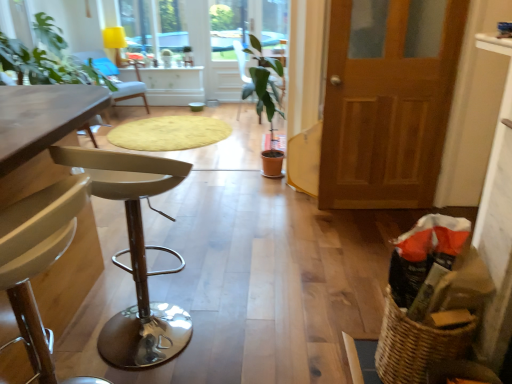
What are the coordinates of `beige textured rug at center` in the screenshot? It's located at (169, 133).

Where is `wooden table at left, which ranks as the 1th table in back-to-front order`? wooden table at left, which ranks as the 1th table in back-to-front order is located at coordinates (40, 132).

What do you see at coordinates (115, 41) in the screenshot?
I see `yellow fabric lampshade at upper center` at bounding box center [115, 41].

What do you see at coordinates (261, 79) in the screenshot? I see `green matte plant at center, positioned as the third chair in left-to-right order` at bounding box center [261, 79].

What do you see at coordinates (135, 258) in the screenshot? The image size is (512, 384). I see `metallic silver stool at left, the second chair when ordered from left to right` at bounding box center [135, 258].

This screenshot has width=512, height=384. Find the location of `beige textured rug at center`. beige textured rug at center is located at coordinates (169, 133).

Which is more distant, (x=190, y=141) or (x=353, y=181)?

The point (x=190, y=141) is farther from the camera.

From a real-world perspective, is beige textured rug at center physically located above or below wooden door at right?

beige textured rug at center is below wooden door at right.

Is beige textured rug at center thinner than wooden door at right?

Incorrect, the width of beige textured rug at center is not less than that of wooden door at right.

In the image, is yellow fabric lampshade at upper center positioned in front of or behind woven brown basket at lower right?

yellow fabric lampshade at upper center is positioned farther from the viewer than woven brown basket at lower right.

Considering the relative sizes of yellow fabric lampshade at upper center and woven brown basket at lower right in the image provided, is yellow fabric lampshade at upper center bigger than woven brown basket at lower right?

Incorrect, yellow fabric lampshade at upper center is not larger than woven brown basket at lower right.

From the image's perspective, is yellow fabric lampshade at upper center under woven brown basket at lower right?

Incorrect, from the image's perspective, yellow fabric lampshade at upper center is higher than woven brown basket at lower right.

Considering their positions, is wooden table at left, which appears as the second table when viewed from the left, located in front of or behind wooden door at right?

Clearly, wooden table at left, which appears as the second table when viewed from the left, is in front of wooden door at right.

Is wooden table at left, marked as the first table in a right-to-left arrangement, shorter than wooden door at right?

Yes, wooden table at left, marked as the first table in a right-to-left arrangement, is shorter than wooden door at right.

In the image, there is a wooden door at right. Find the location of `table below it (from the image's perspective)`. table below it (from the image's perspective) is located at coordinates (40, 133).

Looking at this image, which object is positioned more to the left, wooden table at left, which is the 2th table from back to front, or wooden door at right?

wooden table at left, which is the 2th table from back to front.

Which chair is the 1st one when counting from the front of the light gray fabric chair at upper left, the first chair when ordered from back to front? Please provide its 2D coordinates.

[(261, 79)]

Is light gray fabric chair at upper left, the third chair from the front, further to camera compared to green matte plant at center, placed as the 1th chair when sorted from right to left?

Yes.

From the picture: Is light gray fabric chair at upper left, which is the 1th chair in left-to-right order, wider or thinner than green matte plant at center, which is counted as the 2th chair, starting from the back?

In the image, light gray fabric chair at upper left, which is the 1th chair in left-to-right order, appears to be wider than green matte plant at center, which is counted as the 2th chair, starting from the back.

Is light gray fabric chair at upper left, the third chair from the front, oriented away from green matte plant at center, positioned as the third chair in left-to-right order?

No, light gray fabric chair at upper left, the third chair from the front,'s orientation is not away from green matte plant at center, positioned as the third chair in left-to-right order.

Are wooden door at right and transparent glass window at upper center beside each other?

wooden door at right and transparent glass window at upper center are not in contact.

Would you say wooden door at right is outside transparent glass window at upper center?

Yes, wooden door at right is outside of transparent glass window at upper center.

Is point (395, 77) positioned in front of point (162, 32)?

Yes, point (395, 77) is in front of point (162, 32).

In the scene shown: From the image's perspective, is wooden door at right over transparent glass window at upper center?

No.

Which object is further away from the camera, woven brown basket at lower right or metallic silver stool at left, which appears as the first chair when viewed from the front?

woven brown basket at lower right is behind.

In the scene shown: From a real-world perspective, is woven brown basket at lower right located higher than metallic silver stool at left, the second chair when ordered from left to right?

Actually, woven brown basket at lower right is physically below metallic silver stool at left, the second chair when ordered from left to right, in the real world.

Considering the sizes of woven brown basket at lower right and metallic silver stool at left, the second chair in the right-to-left sequence, in the image, is woven brown basket at lower right bigger or smaller than metallic silver stool at left, the second chair in the right-to-left sequence,?

Considering their sizes, woven brown basket at lower right takes up less space than metallic silver stool at left, the second chair in the right-to-left sequence.

From a real-world perspective, is transparent glass window at upper center on woven brown basket at lower right?

Yes, from a real-world perspective, transparent glass window at upper center is on top of woven brown basket at lower right.

Who is shorter, transparent glass window at upper center or woven brown basket at lower right?

With less height is woven brown basket at lower right.

Is point (125, 17) closer or farther from the camera than point (389, 326)?

Clearly, point (125, 17) is more distant from the camera than point (389, 326).

At what (x,y) coordinates should I click in order to perform the action: click on door above the beige textured rug at center (from a real-world perspective). Please return your answer as a coordinate pair (x, y). This screenshot has width=512, height=384. Looking at the image, I should click on (387, 102).

Where is `basket in front of the yellow fabric lampshade at upper center`? This screenshot has height=384, width=512. basket in front of the yellow fabric lampshade at upper center is located at coordinates (416, 346).

From the image, which object appears to be farther from yellow fabric lampshade at upper center, light gray fabric chair at upper left, which is the 1th chair in left-to-right order, or metallic silver stool at left, the third chair in the back-to-front sequence?

The object further to yellow fabric lampshade at upper center is metallic silver stool at left, the third chair in the back-to-front sequence.

Based on their spatial positions, is wooden table at left, which appears as the second table when viewed from the left, or wooden door at right closer to transparent glass window at upper center?

Based on the image, wooden door at right appears to be nearer to transparent glass window at upper center.

Considering their positions, is wooden door at right positioned further to wooden table at left, marked as the 1th table in a front-to-back arrangement, than transparent glass window at upper center?

Among the two, transparent glass window at upper center is located further to wooden table at left, marked as the 1th table in a front-to-back arrangement.

From the image, which object appears to be farther from woven brown basket at lower right, metallic silver stool at left, which appears as the first chair when viewed from the front, or wooden table at left, which is the 2th table from back to front?

wooden table at left, which is the 2th table from back to front.

When comparing their distances from metallic silver stool at left, the second chair in the right-to-left sequence, does transparent glass window at upper center or yellow fabric lampshade at upper center seem further?

yellow fabric lampshade at upper center is further to metallic silver stool at left, the second chair in the right-to-left sequence.

Based on their spatial positions, is wooden table at left, which ranks as the first table in left-to-right order, or beige textured rug at center closer to metallic silver stool at left, which appears as the first chair when viewed from the front?

Based on the image, wooden table at left, which ranks as the first table in left-to-right order, appears to be nearer to metallic silver stool at left, which appears as the first chair when viewed from the front.

Consider the image. Considering their positions, is transparent glass window at upper center positioned closer to woven brown basket at lower right than light gray fabric chair at upper left, which is the 1th chair in left-to-right order?

light gray fabric chair at upper left, which is the 1th chair in left-to-right order, is closer to woven brown basket at lower right.

Looking at the image, which one is located closer to green matte plant at center, placed as the 1th chair when sorted from right to left, yellow fabric lampshade at upper center or metallic silver stool at left, the second chair in the right-to-left sequence?

metallic silver stool at left, the second chair in the right-to-left sequence, lies closer to green matte plant at center, placed as the 1th chair when sorted from right to left, than the other object.

The image size is (512, 384). In order to click on table between metallic silver stool at left, the second chair when ordered from left to right, and transparent glass window at upper center, along the z-axis in this screenshot , I will do point(40,132).

Find the location of a particular element. chair located between metallic silver stool at left, the third chair in the back-to-front sequence, and beige textured rug at center in the depth direction is located at coordinates (261, 79).

Locate an element on the screen. The image size is (512, 384). door between metallic silver stool at left, the second chair when ordered from left to right, and transparent glass window at upper center in the front-back direction is located at coordinates (387, 102).

I want to click on round table located between light gray fabric chair at upper left, the first chair when ordered from back to front, and wooden door at right in the left-right direction, so click(169, 133).